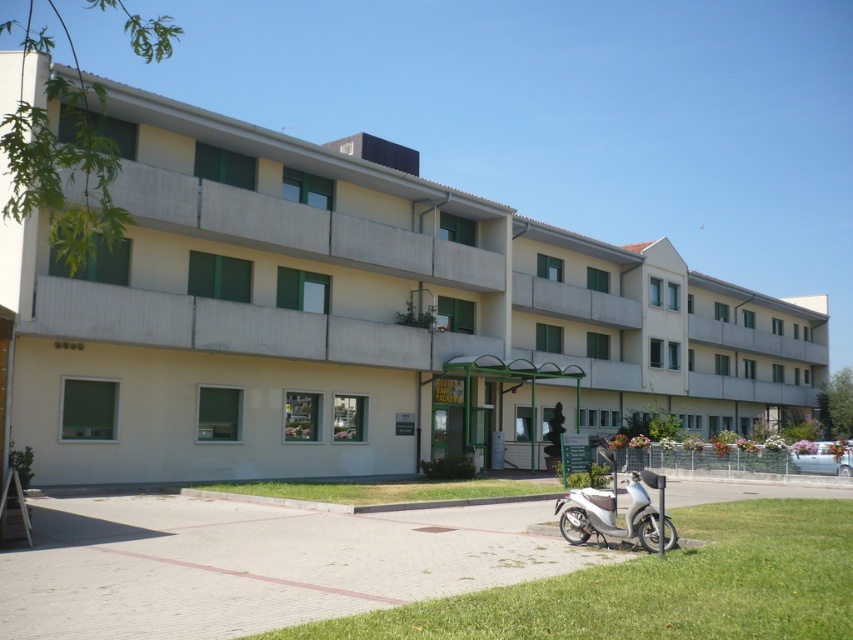
You are standing on the sidewalk in front of the beige concrete building at center. You want to know if the building is wider than the green grass at lower center. Can you determine this from your current vantage point?

The beige concrete building at center might be wider than green grass at lower center, so it is possible that the building is wider than the grass.